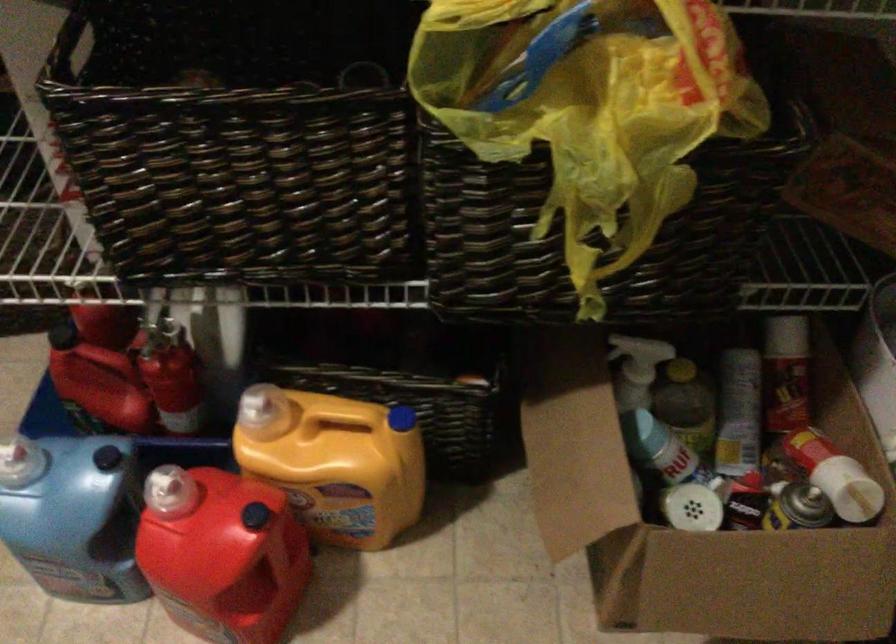
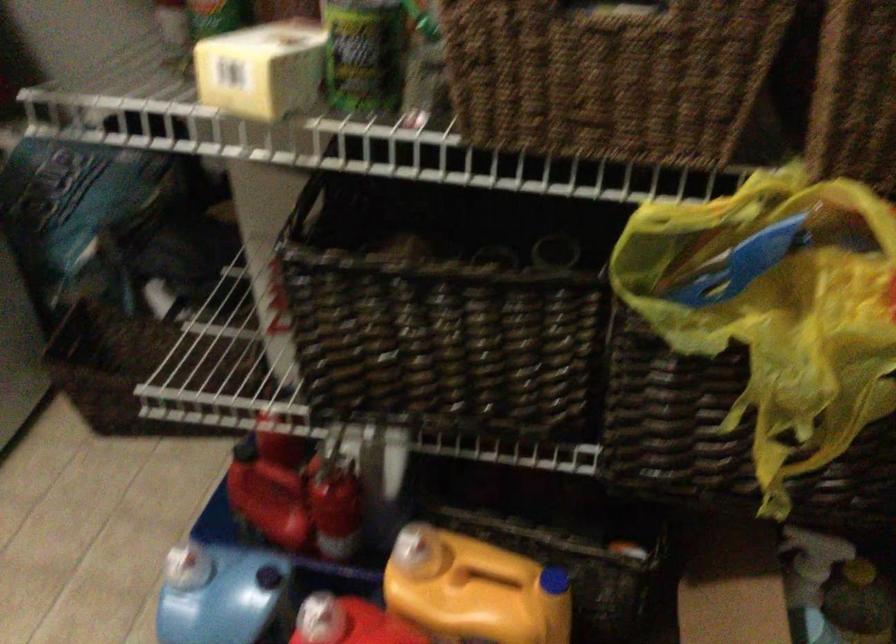
Locate, in the second image, the point that corresponds to pixel 83 303 in the first image.

(269, 426)